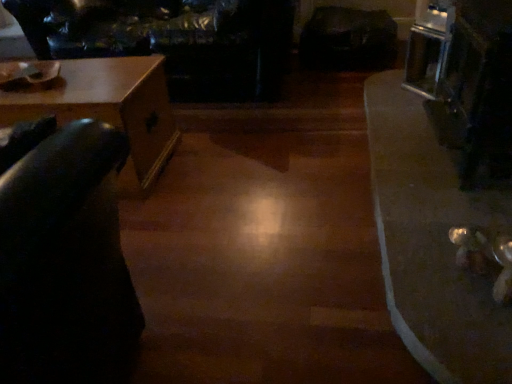
I want to click on free space that is to the left of shiny metallic table at lower right, placed as the second table when sorted from left to right, so click(264, 193).